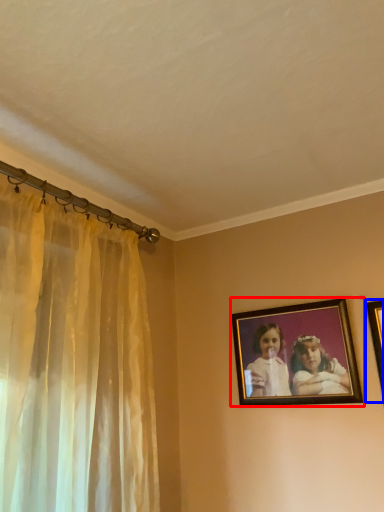
Question: Which of the following is the closest to the observer, picture frame (highlighted by a red box) or picture frame (highlighted by a blue box)?

Choices:
 (A) picture frame
 (B) picture frame

Answer: (B)